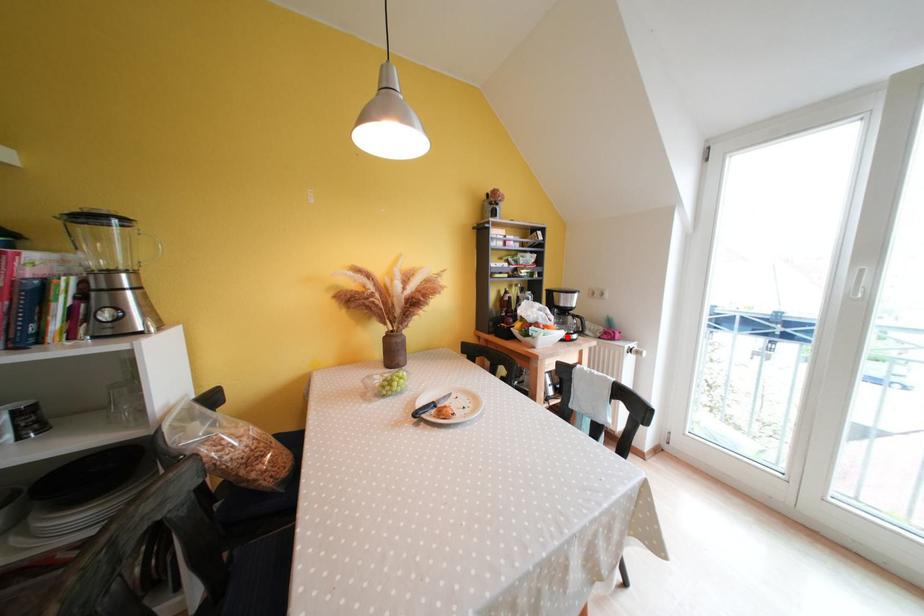
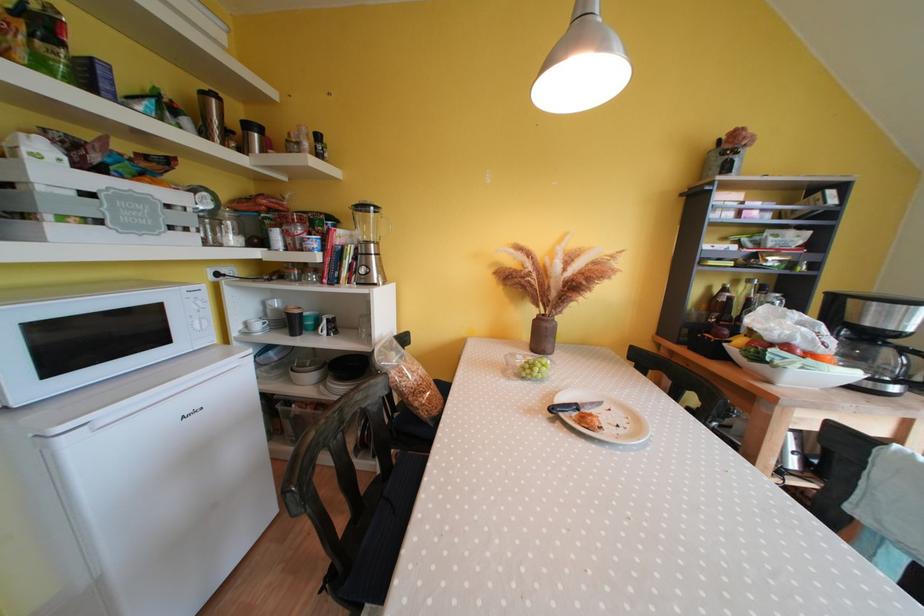
Question: I am providing you with two images of the same scene from different viewpoints. In image1, a red point is highlighted. Considering the same 3D point in image2, which of the following is correct?

Choices:
 (A) It is closer
 (B) It is farther

Answer: (A)